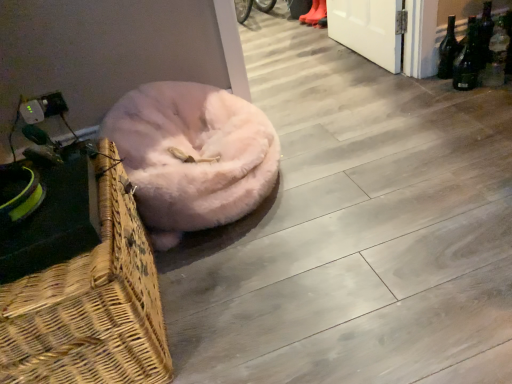
At what (x,y) coordinates should I click in order to perform the action: click on free space to the left of dark green glass bottle at upper right, marked as the 3th bottle in a right-to-left arrangement. Please return your answer as a coordinate pair (x, y). The image size is (512, 384). Looking at the image, I should click on (417, 87).